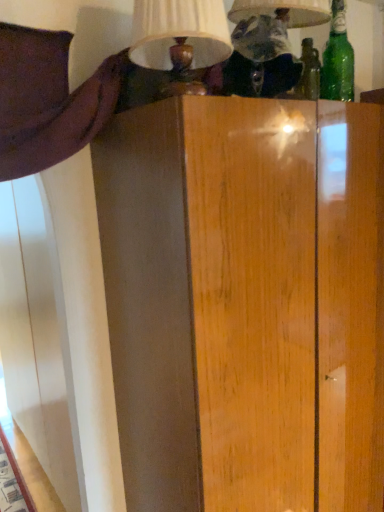
The image size is (384, 512). What do you see at coordinates (337, 59) in the screenshot?
I see `green glass bottle at upper right` at bounding box center [337, 59].

In order to click on matte cream lampshade at upper center, marked as the 1th table lamp in a left-to-right arrangement in this screenshot , I will do `click(181, 44)`.

Which object is wider, matte cream lampshade at upper center, placed as the second table lamp when sorted from right to left, or matte white lampshade at upper center, placed as the first table lamp when sorted from right to left?

With larger width is matte white lampshade at upper center, placed as the first table lamp when sorted from right to left.

Can you confirm if matte cream lampshade at upper center, placed as the second table lamp when sorted from right to left, is positioned to the left of matte white lampshade at upper center, placed as the first table lamp when sorted from right to left?

Indeed, matte cream lampshade at upper center, placed as the second table lamp when sorted from right to left, is positioned on the left side of matte white lampshade at upper center, placed as the first table lamp when sorted from right to left.

Between point (218, 0) and point (243, 47), which one is positioned behind?

The point (243, 47) is more distant.

Is matte cream lampshade at upper center, marked as the 1th table lamp in a left-to-right arrangement, not within matte white lampshade at upper center, positioned as the 2th table lamp in left-to-right order?

Absolutely, matte cream lampshade at upper center, marked as the 1th table lamp in a left-to-right arrangement, is external to matte white lampshade at upper center, positioned as the 2th table lamp in left-to-right order.

Based on the photo, which of these two, green glass bottle at upper right or matte white lampshade at upper center, positioned as the 2th table lamp in left-to-right order, is thinner?

Thinner between the two is green glass bottle at upper right.

Based on their positions, is green glass bottle at upper right located to the left or right of matte white lampshade at upper center, placed as the first table lamp when sorted from right to left?

Clearly, green glass bottle at upper right is on the right of matte white lampshade at upper center, placed as the first table lamp when sorted from right to left, in the image.

Is green glass bottle at upper right smaller than matte white lampshade at upper center, placed as the first table lamp when sorted from right to left?

Yes.

Is green glass bottle at upper right not near matte white lampshade at upper center, placed as the first table lamp when sorted from right to left?

Actually, green glass bottle at upper right and matte white lampshade at upper center, placed as the first table lamp when sorted from right to left, are a little close together.

Does matte cream lampshade at upper center, marked as the 1th table lamp in a left-to-right arrangement, have a lesser width compared to green glass bottle at upper right?

In fact, matte cream lampshade at upper center, marked as the 1th table lamp in a left-to-right arrangement, might be wider than green glass bottle at upper right.

How distant is matte cream lampshade at upper center, placed as the second table lamp when sorted from right to left, from green glass bottle at upper right?

A distance of 25.93 inches exists between matte cream lampshade at upper center, placed as the second table lamp when sorted from right to left, and green glass bottle at upper right.

Is matte cream lampshade at upper center, placed as the second table lamp when sorted from right to left, located outside green glass bottle at upper right?

matte cream lampshade at upper center, placed as the second table lamp when sorted from right to left, lies outside green glass bottle at upper right's area.

From the image's perspective, does matte cream lampshade at upper center, marked as the 1th table lamp in a left-to-right arrangement, appear lower than green glass bottle at upper right?

Yes, from the image's perspective, matte cream lampshade at upper center, marked as the 1th table lamp in a left-to-right arrangement, is beneath green glass bottle at upper right.

Looking at this image, which is more to the right, matte white lampshade at upper center, placed as the first table lamp when sorted from right to left, or matte cream lampshade at upper center, marked as the 1th table lamp in a left-to-right arrangement?

From the viewer's perspective, matte white lampshade at upper center, placed as the first table lamp when sorted from right to left, appears more on the right side.

Identify the location of table lamp on the left side of matte white lampshade at upper center, positioned as the 2th table lamp in left-to-right order. (181, 44).

Is matte white lampshade at upper center, positioned as the 2th table lamp in left-to-right order, looking in the opposite direction of matte cream lampshade at upper center, marked as the 1th table lamp in a left-to-right arrangement?

No, matte white lampshade at upper center, positioned as the 2th table lamp in left-to-right order, is not facing the opposite direction of matte cream lampshade at upper center, marked as the 1th table lamp in a left-to-right arrangement.

Can you confirm if matte white lampshade at upper center, positioned as the 2th table lamp in left-to-right order, is shorter than matte cream lampshade at upper center, marked as the 1th table lamp in a left-to-right arrangement?

No, matte white lampshade at upper center, positioned as the 2th table lamp in left-to-right order, is not shorter than matte cream lampshade at upper center, marked as the 1th table lamp in a left-to-right arrangement.

Is matte white lampshade at upper center, positioned as the 2th table lamp in left-to-right order, looking in the opposite direction of green glass bottle at upper right?

matte white lampshade at upper center, positioned as the 2th table lamp in left-to-right order, is not turned away from green glass bottle at upper right.

From the image's perspective, is matte white lampshade at upper center, positioned as the 2th table lamp in left-to-right order, above green glass bottle at upper right?

Actually, matte white lampshade at upper center, positioned as the 2th table lamp in left-to-right order, appears below green glass bottle at upper right in the image.

Does matte white lampshade at upper center, positioned as the 2th table lamp in left-to-right order, have a smaller size compared to green glass bottle at upper right?

Actually, matte white lampshade at upper center, positioned as the 2th table lamp in left-to-right order, might be larger than green glass bottle at upper right.

Are matte white lampshade at upper center, placed as the first table lamp when sorted from right to left, and green glass bottle at upper right located far from each other?

They are positioned close to each other.

Is green glass bottle at upper right facing towards matte cream lampshade at upper center, placed as the second table lamp when sorted from right to left?

No.

Is green glass bottle at upper right situated inside matte cream lampshade at upper center, placed as the second table lamp when sorted from right to left, or outside?

green glass bottle at upper right exists outside the volume of matte cream lampshade at upper center, placed as the second table lamp when sorted from right to left.

The image size is (384, 512). I want to click on table lamp that is the 2nd object to the left of the green glass bottle at upper right, starting at the anchor, so click(181, 44).

Based on the photo, is the surface of green glass bottle at upper right in direct contact with matte cream lampshade at upper center, marked as the 1th table lamp in a left-to-right arrangement?

No, green glass bottle at upper right is not beside matte cream lampshade at upper center, marked as the 1th table lamp in a left-to-right arrangement.

Where is `table lamp above the matte cream lampshade at upper center, marked as the 1th table lamp in a left-to-right arrangement (from a real-world perspective)`? Image resolution: width=384 pixels, height=512 pixels. table lamp above the matte cream lampshade at upper center, marked as the 1th table lamp in a left-to-right arrangement (from a real-world perspective) is located at coordinates (268, 42).

Locate an element on the screen. This screenshot has width=384, height=512. bottle located on the right of matte white lampshade at upper center, positioned as the 2th table lamp in left-to-right order is located at coordinates (337, 59).

Looking at the image, which one is located closer to green glass bottle at upper right, matte cream lampshade at upper center, marked as the 1th table lamp in a left-to-right arrangement, or matte white lampshade at upper center, positioned as the 2th table lamp in left-to-right order?

matte white lampshade at upper center, positioned as the 2th table lamp in left-to-right order.

Estimate the real-world distances between objects in this image. Which object is closer to matte white lampshade at upper center, placed as the first table lamp when sorted from right to left, matte cream lampshade at upper center, marked as the 1th table lamp in a left-to-right arrangement, or green glass bottle at upper right?

matte cream lampshade at upper center, marked as the 1th table lamp in a left-to-right arrangement, is positioned closer to the anchor matte white lampshade at upper center, placed as the first table lamp when sorted from right to left.

Considering their positions, is matte white lampshade at upper center, positioned as the 2th table lamp in left-to-right order, positioned closer to matte cream lampshade at upper center, placed as the second table lamp when sorted from right to left, than green glass bottle at upper right?

The object closer to matte cream lampshade at upper center, placed as the second table lamp when sorted from right to left, is matte white lampshade at upper center, positioned as the 2th table lamp in left-to-right order.

When comparing their distances from green glass bottle at upper right, does matte white lampshade at upper center, placed as the first table lamp when sorted from right to left, or matte cream lampshade at upper center, placed as the second table lamp when sorted from right to left, seem closer?

Among the two, matte white lampshade at upper center, placed as the first table lamp when sorted from right to left, is located nearer to green glass bottle at upper right.

Which object lies nearer to the anchor point matte white lampshade at upper center, positioned as the 2th table lamp in left-to-right order, green glass bottle at upper right or matte cream lampshade at upper center, placed as the second table lamp when sorted from right to left?

matte cream lampshade at upper center, placed as the second table lamp when sorted from right to left, is closer to matte white lampshade at upper center, positioned as the 2th table lamp in left-to-right order.

Looking at the image, which one is located closer to matte cream lampshade at upper center, placed as the second table lamp when sorted from right to left, green glass bottle at upper right or matte white lampshade at upper center, positioned as the 2th table lamp in left-to-right order?

matte white lampshade at upper center, positioned as the 2th table lamp in left-to-right order, is closer to matte cream lampshade at upper center, placed as the second table lamp when sorted from right to left.

What are the coordinates of `table lamp between matte cream lampshade at upper center, marked as the 1th table lamp in a left-to-right arrangement, and green glass bottle at upper right` in the screenshot? It's located at (268, 42).